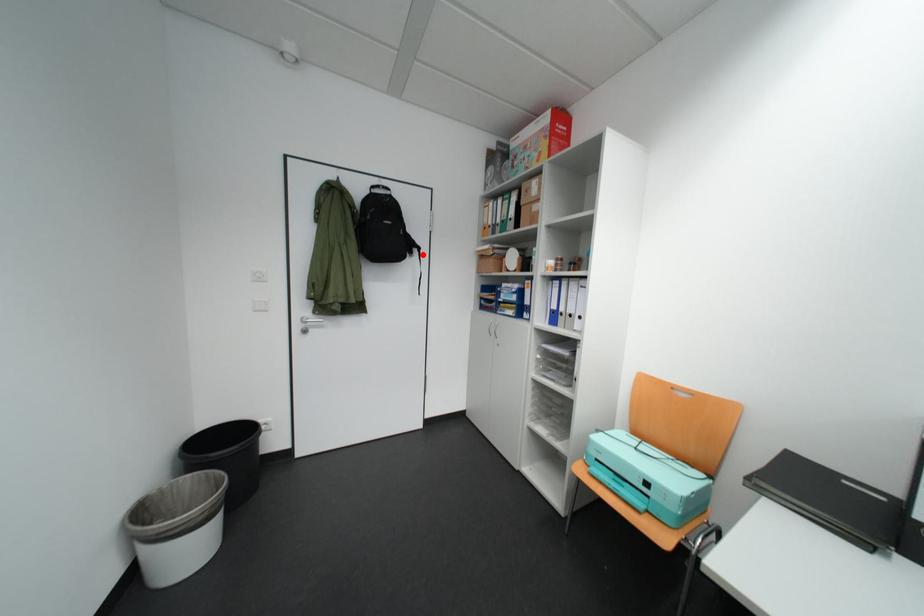
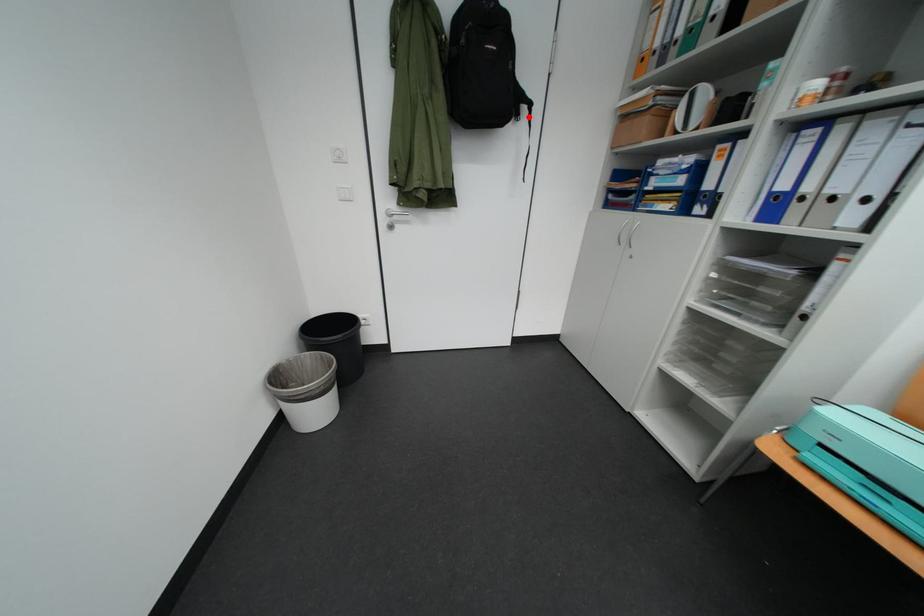
I am providing you with two images of the same scene from different viewpoints. A red point is marked on the first image and another point is marked on the second image. Is the red point in image1 aligned with the point shown in image2?

Yes